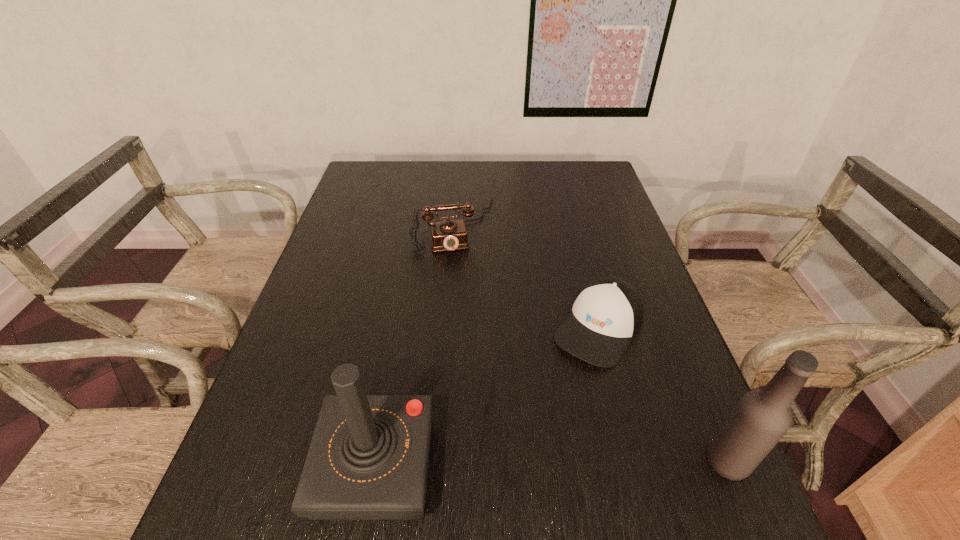
Where is `joystick`? The width and height of the screenshot is (960, 540). joystick is located at coordinates (368, 459).

The height and width of the screenshot is (540, 960). Find the location of `the rightmost object`. the rightmost object is located at coordinates (759, 420).

Locate an element on the screen. The width and height of the screenshot is (960, 540). the third nearest object is located at coordinates (607, 314).

I want to click on the shortest object, so click(x=607, y=314).

Image resolution: width=960 pixels, height=540 pixels. Identify the location of the farthest object. (448, 235).

Locate an element on the screen. This screenshot has width=960, height=540. free space located on the rectangular base of the joystick is located at coordinates (248, 466).

Image resolution: width=960 pixels, height=540 pixels. I want to click on vacant region located 0.090m on the rectangular base of the joystick, so click(x=270, y=466).

The height and width of the screenshot is (540, 960). What are the coordinates of `free space located on the front panel of the third nearest object` in the screenshot? It's located at (x=558, y=390).

Find the location of a particular element. vacant area located 0.270m on the front panel of the third nearest object is located at coordinates (511, 458).

You are a GUI agent. You are given a task and a screenshot of the screen. Output one action in this format:
    pyautogui.click(x=<x>, y=<y>)
    Task: Click on the free space located 0.110m on the front panel of the third nearest object
    
    Given the screenshot: What is the action you would take?
    pyautogui.click(x=553, y=397)